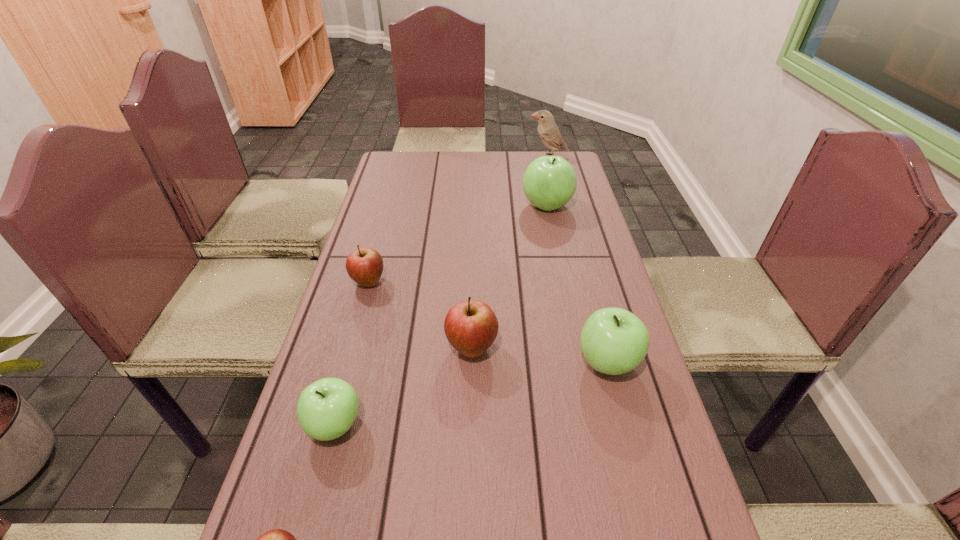
Identify the location of unoccupied area between the farthest apple and the second biggest red apple. (458, 244).

Find the location of a particular element. object that is the sixth closest to the fifth nearest apple is located at coordinates (549, 133).

This screenshot has width=960, height=540. In order to click on the second closest object to the second farthest red apple in this screenshot , I will do `click(614, 341)`.

Point out which apple is positioned as the fourth nearest to the sixth farthest object. Please provide its 2D coordinates. Your answer should be formatted as a tuple, i.e. [(x, y)], where the tuple contains the x and y coordinates of a point satisfying the conditions above.

[(614, 341)]

Where is `the closest apple to the smallest red apple`? This screenshot has height=540, width=960. the closest apple to the smallest red apple is located at coordinates (327, 408).

Point out which green apple is positioned as the nearest to the second smallest red apple. Please provide its 2D coordinates. Your answer should be formatted as a tuple, i.e. [(x, y)], where the tuple contains the x and y coordinates of a point satisfying the conditions above.

[(327, 408)]

Identify which green apple is the second closest to the second smallest green apple. Please provide its 2D coordinates. Your answer should be formatted as a tuple, i.e. [(x, y)], where the tuple contains the x and y coordinates of a point satisfying the conditions above.

[(549, 182)]

Identify which red apple is the second closest to the nearest red apple. Please provide its 2D coordinates. Your answer should be formatted as a tuple, i.e. [(x, y)], where the tuple contains the x and y coordinates of a point satisfying the conditions above.

[(365, 265)]

Point out which red apple is positioned as the nearest to the second farthest green apple. Please provide its 2D coordinates. Your answer should be formatted as a tuple, i.e. [(x, y)], where the tuple contains the x and y coordinates of a point satisfying the conditions above.

[(471, 327)]

At what (x,y) coordinates should I click in order to perform the action: click on vacant space that satisfies the following two spatial constraints: 1. on the back side of the leftmost green apple; 2. on the left side of the farthest green apple. Please return your answer as a coordinate pair (x, y). The image size is (960, 540). Looking at the image, I should click on (394, 206).